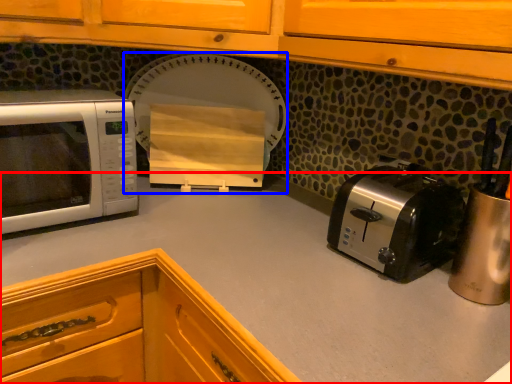
Question: Which object is closer to the camera taking this photo, countertop (highlighted by a red box) or appliance (highlighted by a blue box)?

Choices:
 (A) countertop
 (B) appliance

Answer: (A)